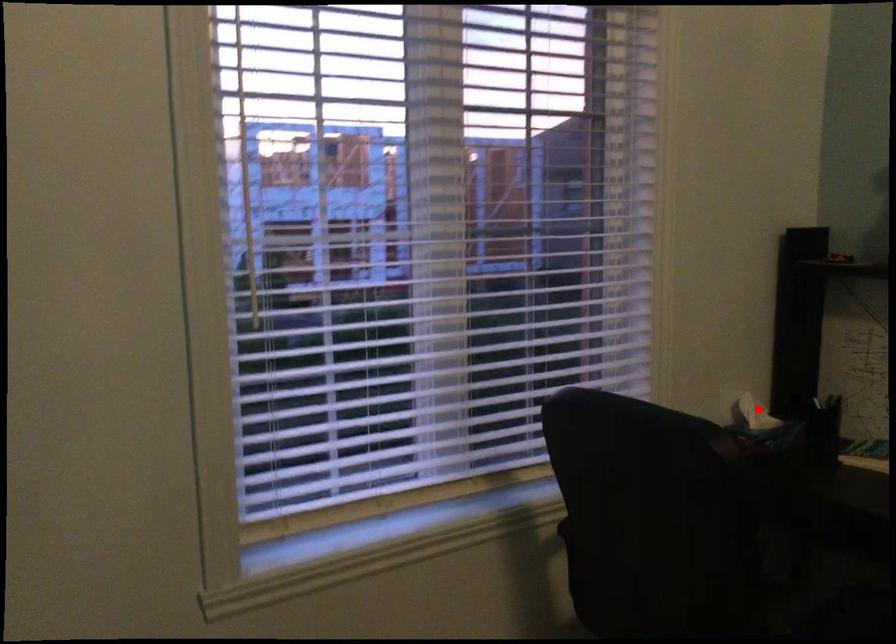
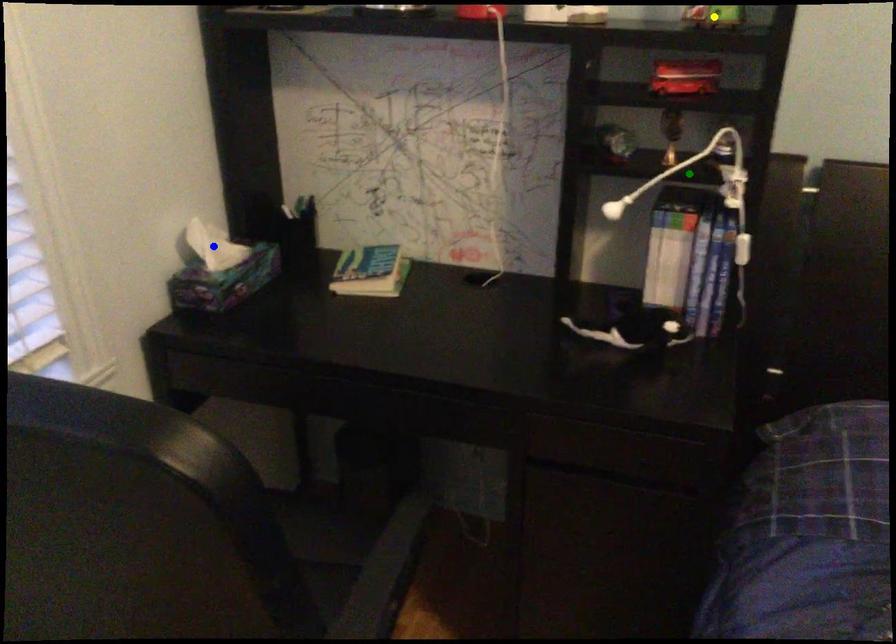
Question: I am providing you with two images of the same scene from different viewpoints. A red point is marked on the first image. You are given multiple points on the second image. Which spot in image 2 lines up with the point in image 1?

Choices:
 (A) green point
 (B) yellow point
 (C) blue point

Answer: (C)